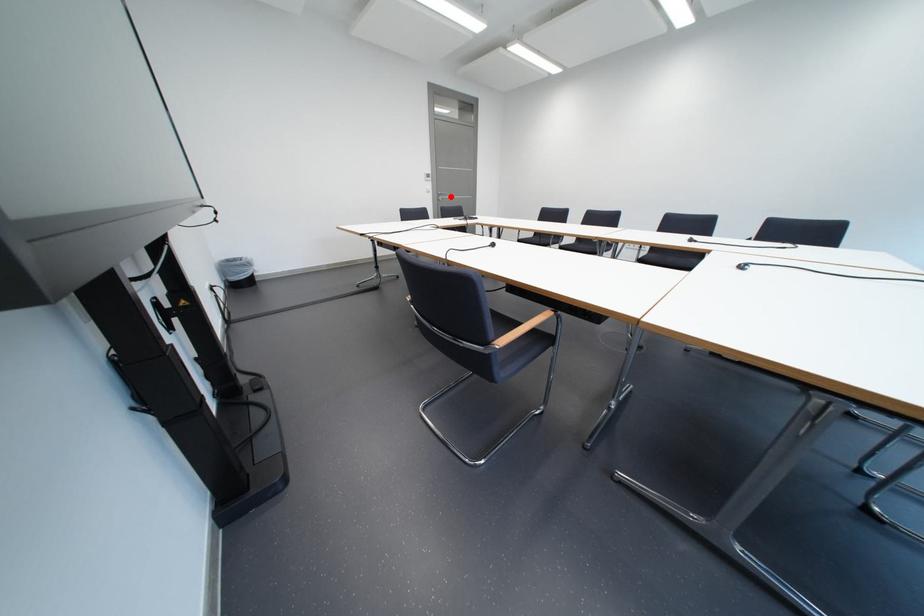
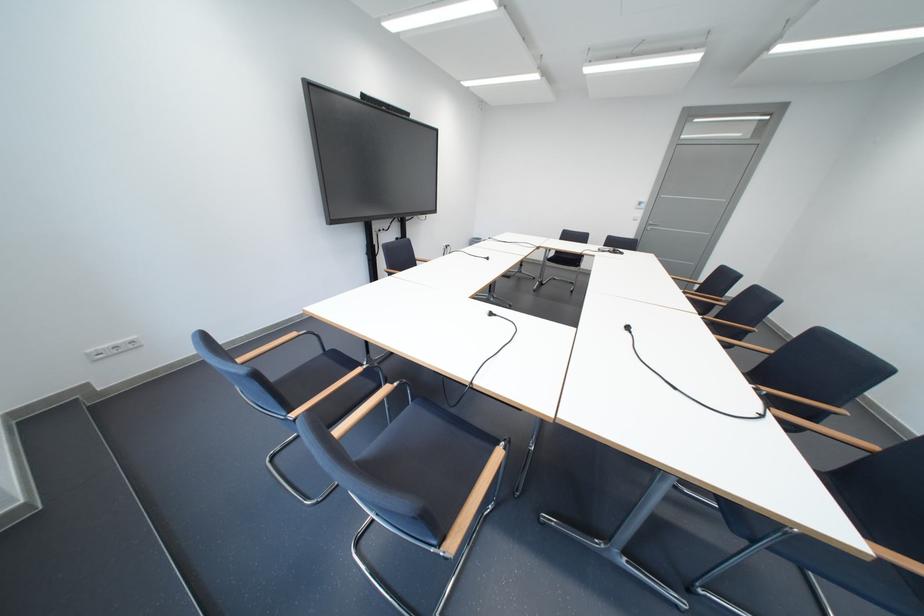
Question: I am providing you with two images of the same scene from different viewpoints. A red point is marked on the first image. Is the red point's position out of view in image 2?

Choices:
 (A) Yes
 (B) No

Answer: (B)